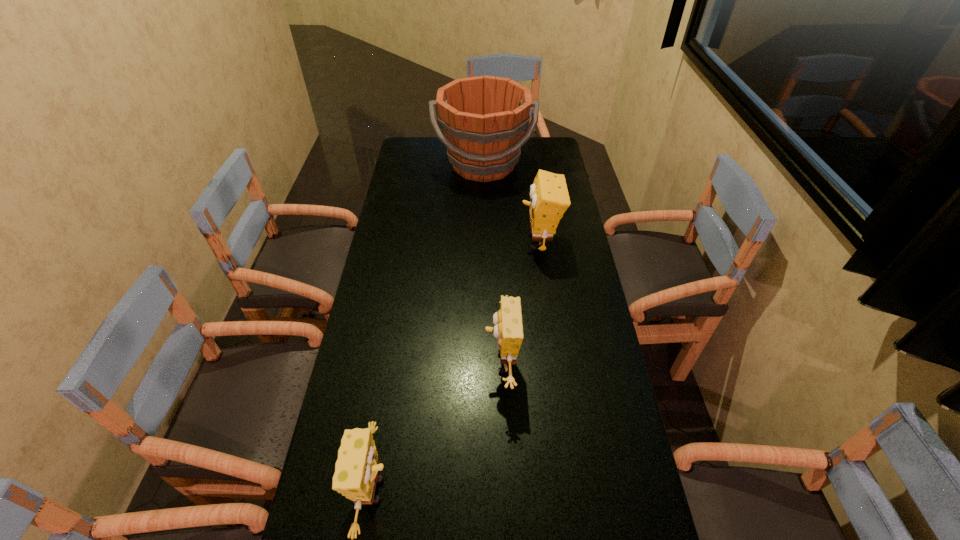
Image resolution: width=960 pixels, height=540 pixels. I want to click on vacant space at the right edge of the desktop, so click(598, 330).

Locate an element on the screen. vacant space at the far right corner of the desktop is located at coordinates (542, 153).

This screenshot has height=540, width=960. I want to click on vacant space that is in between the second farthest sponge and the farthest object, so click(x=492, y=264).

Locate which object is the closest to the nearest object. Please provide its 2D coordinates. Your answer should be formatted as a tuple, i.e. [(x, y)], where the tuple contains the x and y coordinates of a point satisfying the conditions above.

[(508, 330)]

Identify which object is the closest to the nearest object. Please provide its 2D coordinates. Your answer should be formatted as a tuple, i.e. [(x, y)], where the tuple contains the x and y coordinates of a point satisfying the conditions above.

[(508, 330)]

Identify which sponge is located as the second nearest to the tallest sponge. Please provide its 2D coordinates. Your answer should be formatted as a tuple, i.e. [(x, y)], where the tuple contains the x and y coordinates of a point satisfying the conditions above.

[(356, 470)]

Identify which sponge is located as the nearest to the tallest sponge. Please provide its 2D coordinates. Your answer should be formatted as a tuple, i.e. [(x, y)], where the tuple contains the x and y coordinates of a point satisfying the conditions above.

[(508, 330)]